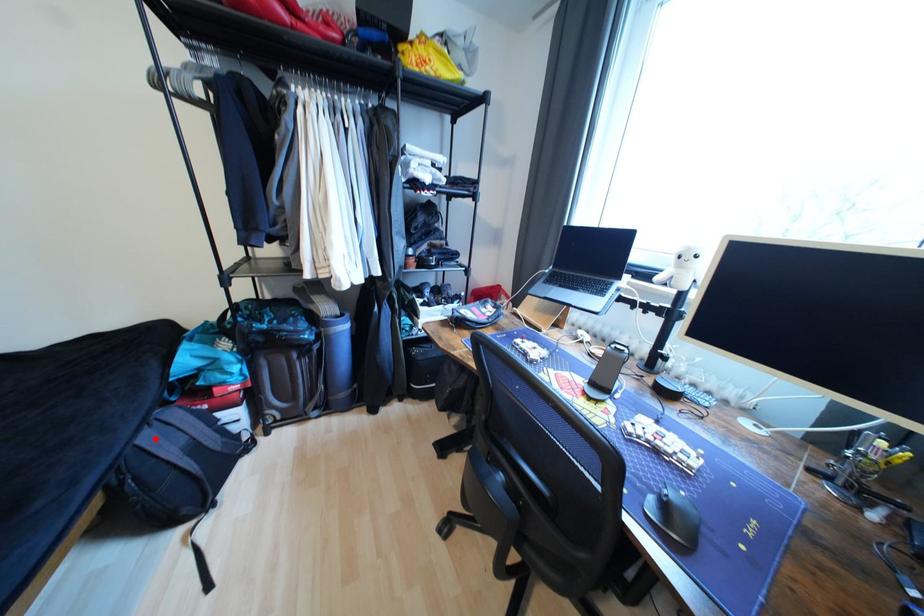
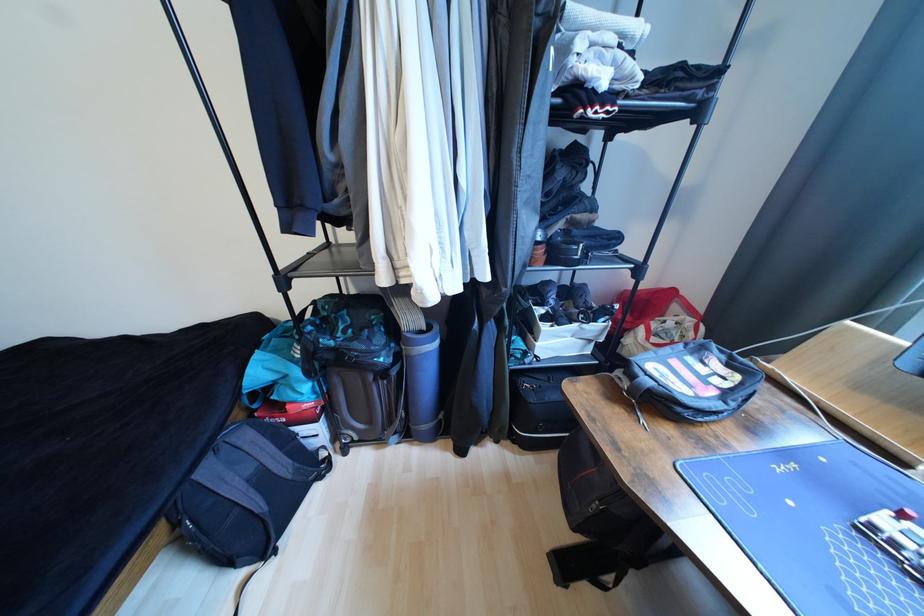
Question: I am providing you with two images of the same scene from different viewpoints. A red point is marked on the first image. Is the red point's position out of view in image 2?

Choices:
 (A) Yes
 (B) No

Answer: (B)